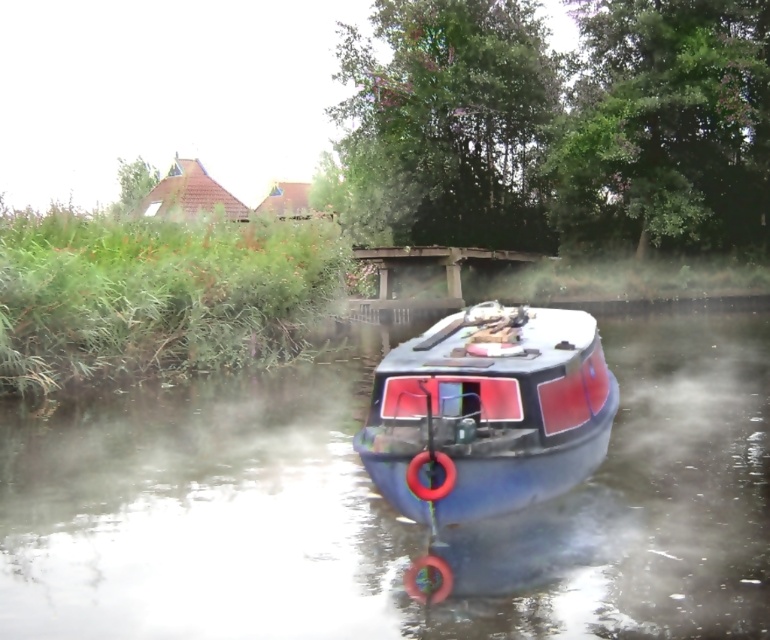
You are navigating a narrowboat on a calm waterway and need to dock your blue rubber boat at center. The docking area is at point 0.8, 0.5. Can you safely dock there?

The blue rubber boat at center is located at point [387,508], which is very close to the docking area at [385,512]. The slight difference in coordinates means the boat is almost exactly at the docking point, so docking should be safe and straightforward.

You are standing on the bank of the waterway and see both the blue rubber boat at center and the blue matte boat at center. Which boat would appear larger to you?

The blue rubber boat at center would appear larger because it is closer to the viewer than the blue matte boat at center.

You are standing at the edge of the waterway next to the narrowboat and want to reach a specific point marked at coordinates point (327, 614). If your maximum reach is 5 meters, can you comfortably extend your arm to touch that point without moving your feet?

The point (327, 614) is 5.36 meters away from the camera, which is slightly beyond your 5 meter reach. You would not be able to comfortably touch it without moving your feet.